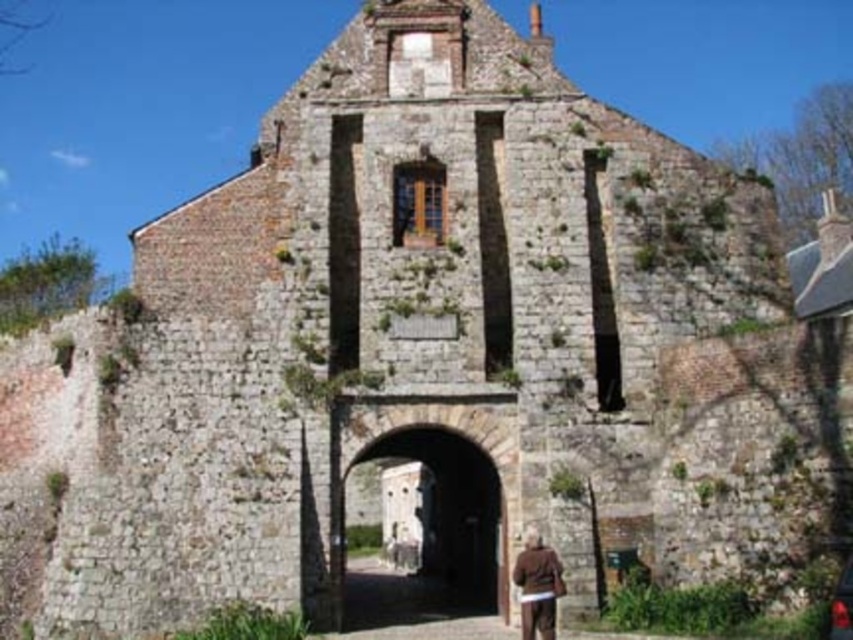
Question: Which point is farther from the camera taking this photo?

Choices:
 (A) (500, 589)
 (B) (845, 612)
 (C) (523, 573)

Answer: (A)

Question: Can you confirm if stone archway at center is thinner than brown leather jacket at lower center?

Choices:
 (A) yes
 (B) no

Answer: (B)

Question: Is stone archway at center thinner than shiny black car at lower right?

Choices:
 (A) no
 (B) yes

Answer: (A)

Question: Among these objects, which one is nearest to the camera?

Choices:
 (A) stone archway at center
 (B) shiny black car at lower right

Answer: (B)

Question: Can you confirm if brown leather jacket at lower center is thinner than shiny black car at lower right?

Choices:
 (A) no
 (B) yes

Answer: (B)

Question: Based on their relative distances, which object is nearer to the shiny black car at lower right?

Choices:
 (A) stone archway at center
 (B) brown leather jacket at lower center

Answer: (B)